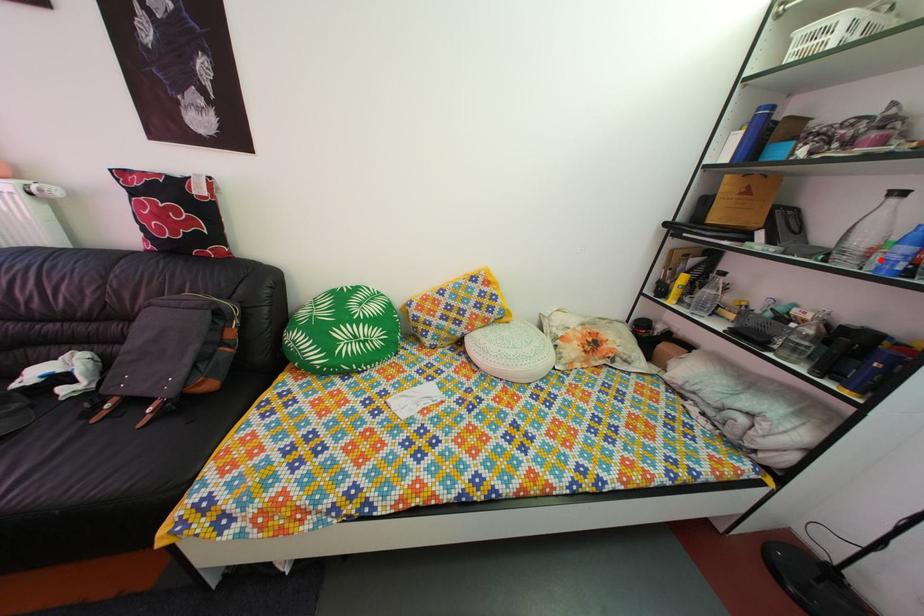
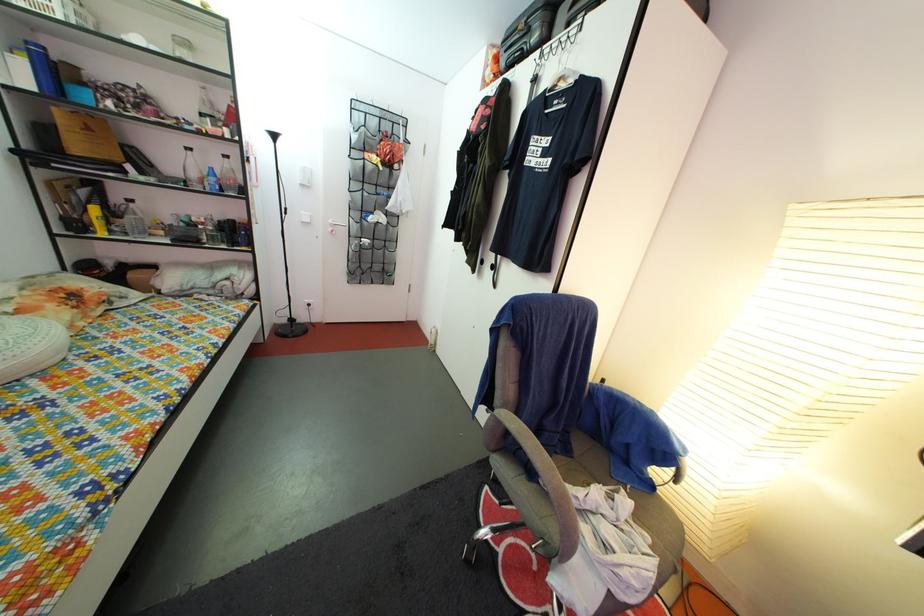
Find the pixel in the second image that matches the highlighted location in the first image.

(211, 188)